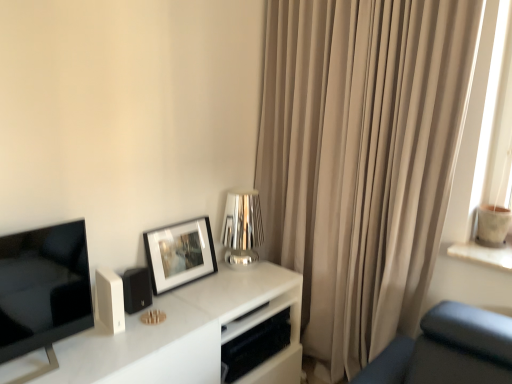
Locate an element on the screen. Image resolution: width=512 pixels, height=384 pixels. free space above white marble tv stand at center (from a real-world perspective) is located at coordinates (150, 327).